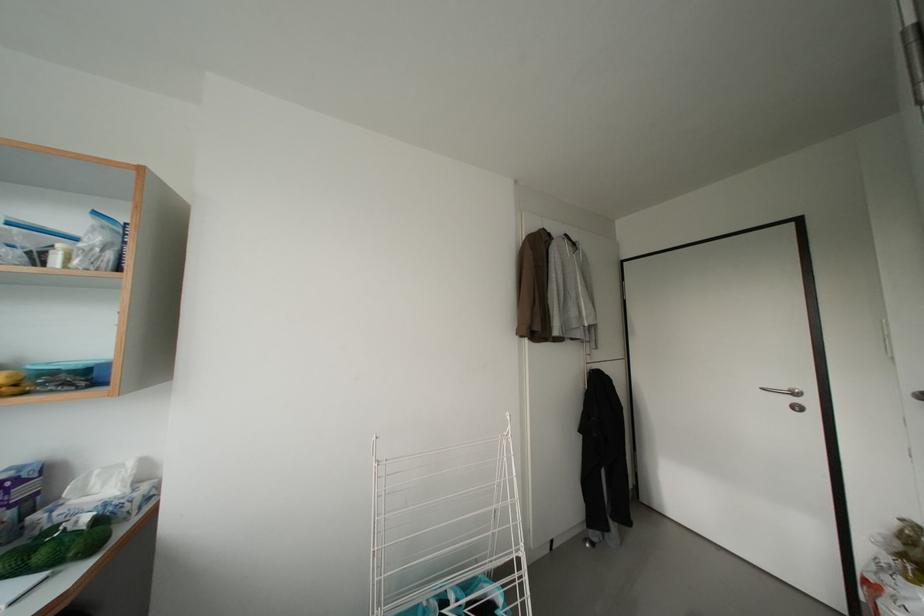
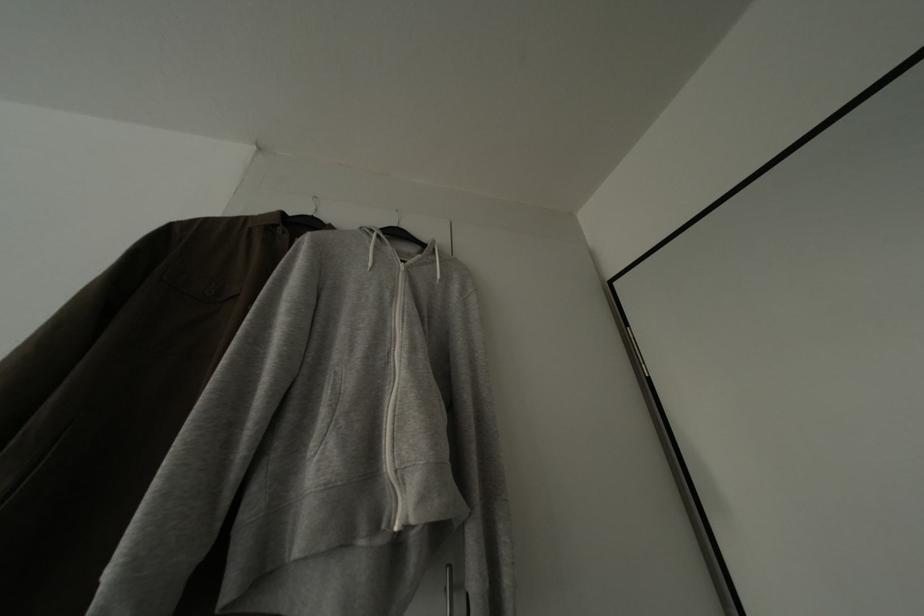
Where in the second image is the point corresponding to [580,249] from the first image?

(431, 252)